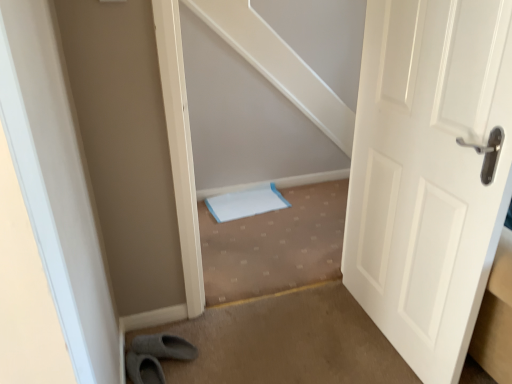
Question: From the image's perspective, is carpeted stairwell at center located above or below white matte door at right?

Choices:
 (A) below
 (B) above

Answer: (A)

Question: Relative to white matte door at right, is carpeted stairwell at center in front or behind?

Choices:
 (A) front
 (B) behind

Answer: (B)

Question: From a real-world perspective, is carpeted stairwell at center positioned above or below white matte door at right?

Choices:
 (A) above
 (B) below

Answer: (B)

Question: Is white matte door at right taller or shorter than carpeted stairwell at center?

Choices:
 (A) short
 (B) tall

Answer: (B)

Question: Based on their sizes in the image, would you say white matte door at right is bigger or smaller than carpeted stairwell at center?

Choices:
 (A) small
 (B) big

Answer: (B)

Question: From a real-world perspective, is white matte door at right above or below carpeted stairwell at center?

Choices:
 (A) below
 (B) above

Answer: (B)

Question: Considering their positions, is white matte door at right located in front of or behind carpeted stairwell at center?

Choices:
 (A) behind
 (B) front

Answer: (B)